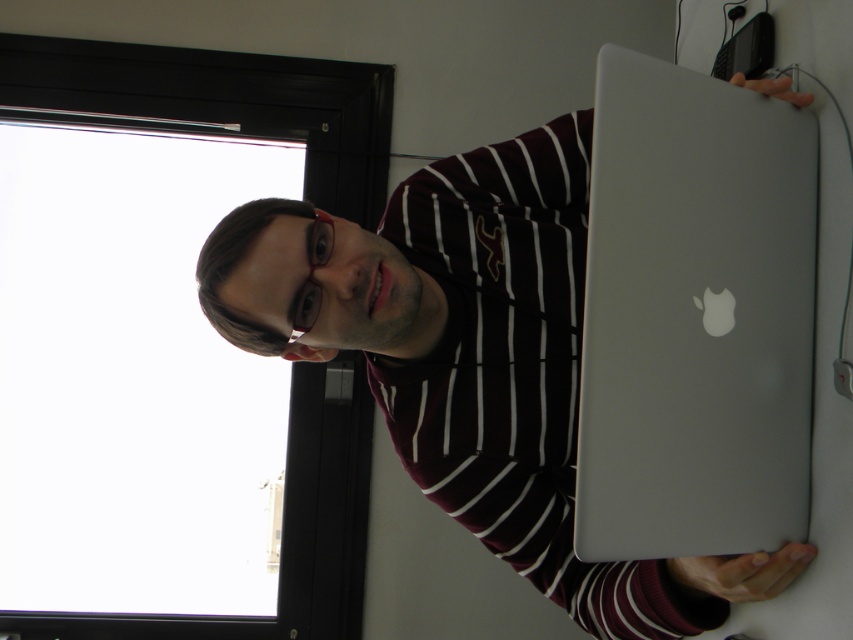
You are organizing a desk and need to place both the silver metallic laptop at upper right and the sleek silver laptop at center. According to their current positions, which laptop should you move to the left to make space for a new monitor on the right side?

The silver metallic laptop at upper right is already on the left side of the sleek silver laptop at center, so you should move the sleek silver laptop at center to the right to create space on the left for the new monitor.

Based on the photo, you are a delivery person who needs to place a 6 inch long package between the silver metallic laptop at upper right and the sleek silver laptop at center. Can you fit it there?

The distance between the silver metallic laptop at upper right and the sleek silver laptop at center is 5.30 inches. Since the package is 6 inches long, it cannot fit in the space between them.